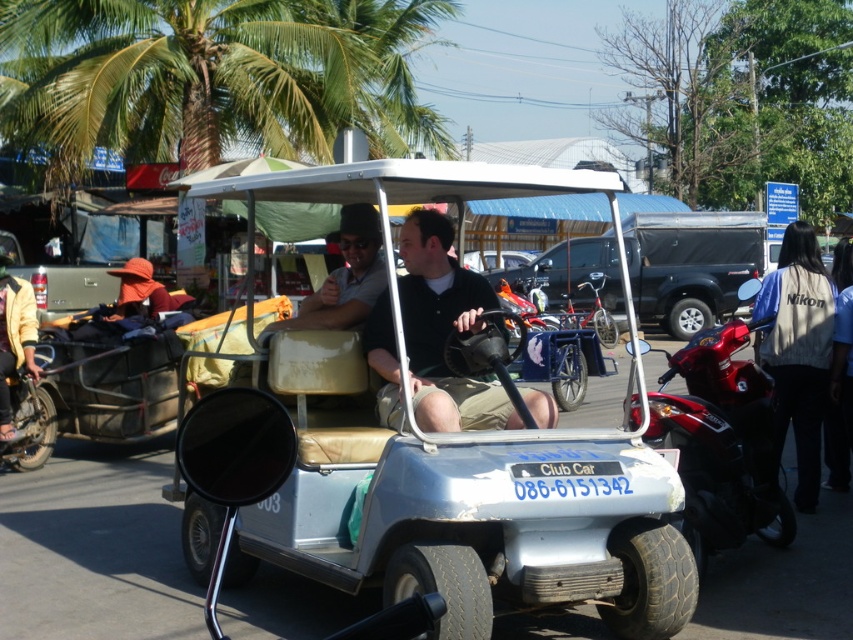
The image size is (853, 640). What do you see at coordinates (15, 340) in the screenshot? I see `yellow fabric bag at left` at bounding box center [15, 340].

Which is behind, point (1, 300) or point (38, 360)?

Positioned behind is point (38, 360).

At what (x,y) coordinates should I click in order to perform the action: click on yellow fabric bag at left. Please return your answer as a coordinate pair (x, y). The height and width of the screenshot is (640, 853). Looking at the image, I should click on (15, 340).

Can you confirm if matte black shirt at center is positioned below blue denim jacket at right?

Incorrect, matte black shirt at center is not positioned below blue denim jacket at right.

Is matte black shirt at center taller than blue denim jacket at right?

Indeed, matte black shirt at center has a greater height compared to blue denim jacket at right.

Between point (380, 236) and point (848, 467), which one is positioned behind?

Positioned behind is point (848, 467).

The image size is (853, 640). Find the location of `matte black shirt at center`. matte black shirt at center is located at coordinates (345, 276).

Who is more forward, (805, 429) or (15, 344)?

Positioned in front is point (805, 429).

In the scene shown: Does khaki fabric jacket at right have a greater height compared to yellow fabric bag at left?

Yes.

What do you see at coordinates (798, 349) in the screenshot?
I see `khaki fabric jacket at right` at bounding box center [798, 349].

This screenshot has height=640, width=853. I want to click on khaki fabric jacket at right, so click(x=798, y=349).